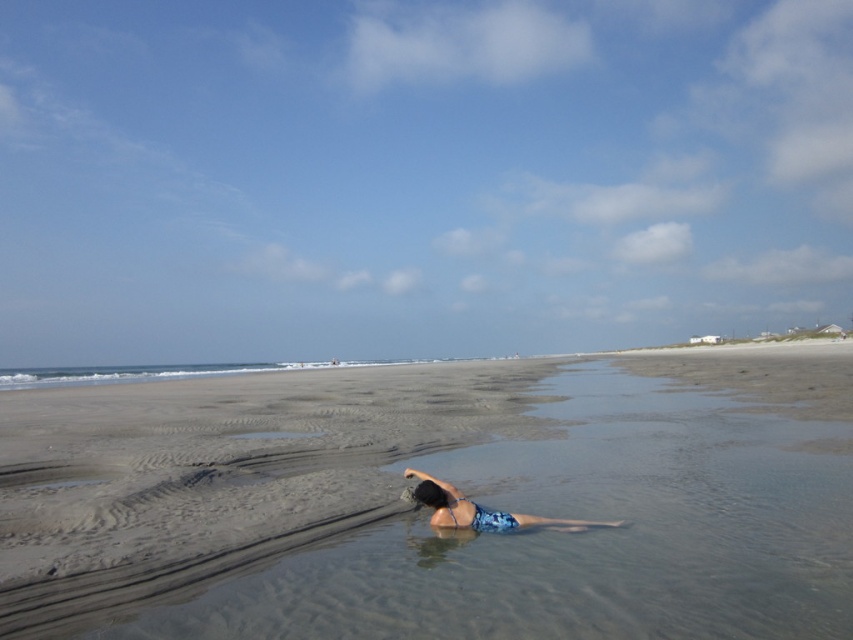
Question: Which point is closer to the camera taking this photo?

Choices:
 (A) (265, 554)
 (B) (491, 515)

Answer: (A)

Question: Is smooth sand at lower center behind blue printed swimsuit at center?

Choices:
 (A) no
 (B) yes

Answer: (A)

Question: Which point is closer to the camera taking this photo?

Choices:
 (A) (527, 525)
 (B) (564, 627)

Answer: (B)

Question: Observing the image, what is the correct spatial positioning of smooth sand at lower center in reference to blue printed swimsuit at center?

Choices:
 (A) right
 (B) left

Answer: (B)

Question: Where is smooth sand at lower center located in relation to blue printed swimsuit at center in the image?

Choices:
 (A) right
 (B) left

Answer: (B)